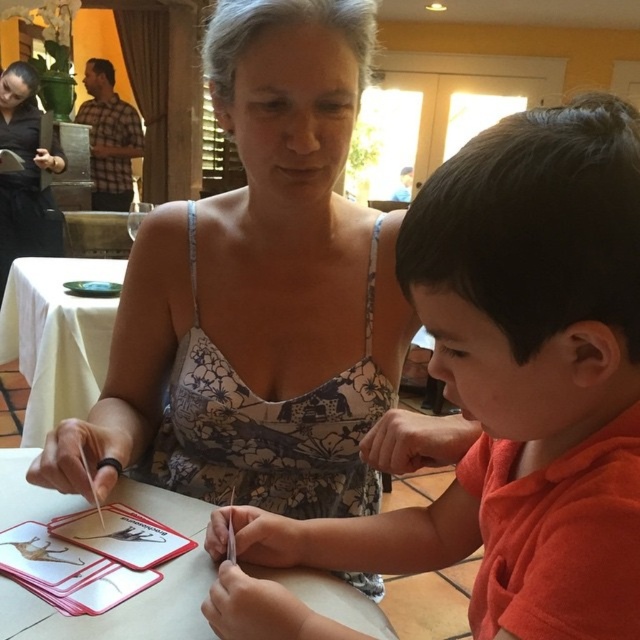
Question: Is wooden table at center below black floral dress at center?

Choices:
 (A) no
 (B) yes

Answer: (B)

Question: Can you confirm if orange matte shirt at center is wider than floral fabric dress at center?

Choices:
 (A) no
 (B) yes

Answer: (A)

Question: Which point is closer to the camera?

Choices:
 (A) (374, 630)
 (B) (8, 81)
 (C) (92, 397)

Answer: (A)

Question: Considering the relative positions of floral fabric dress at center and white cloth at lower left in the image provided, where is floral fabric dress at center located with respect to white cloth at lower left?

Choices:
 (A) right
 (B) left

Answer: (A)

Question: Which object is farther from the camera taking this photo?

Choices:
 (A) orange matte shirt at center
 (B) wooden table at center
 (C) black floral dress at center
 (D) white cloth at lower left

Answer: (C)

Question: Which point appears farthest from the camera in this image?

Choices:
 (A) (1, 84)
 (B) (508, 384)
 (C) (291, 120)

Answer: (A)